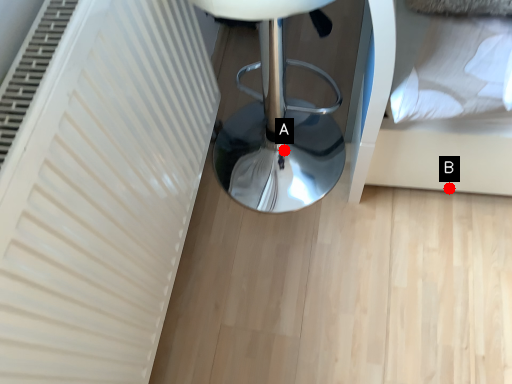
Question: Two points are circled on the image, labeled by A and B beside each circle. Which point is closer to the camera?

Choices:
 (A) A is closer
 (B) B is closer

Answer: (B)